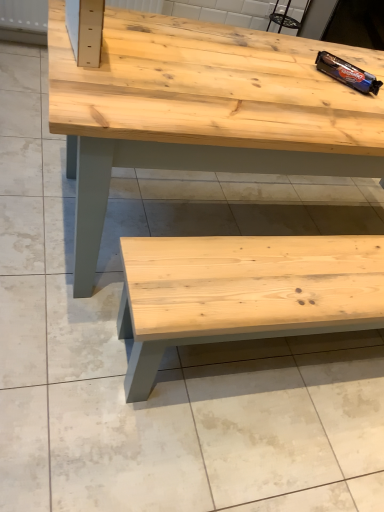
Locate an element on the screen. The height and width of the screenshot is (512, 384). natural wood table at center is located at coordinates (202, 109).

What do you see at coordinates (202, 109) in the screenshot?
I see `natural wood table at center` at bounding box center [202, 109].

Identify the location of natural wood table at center. (202, 109).